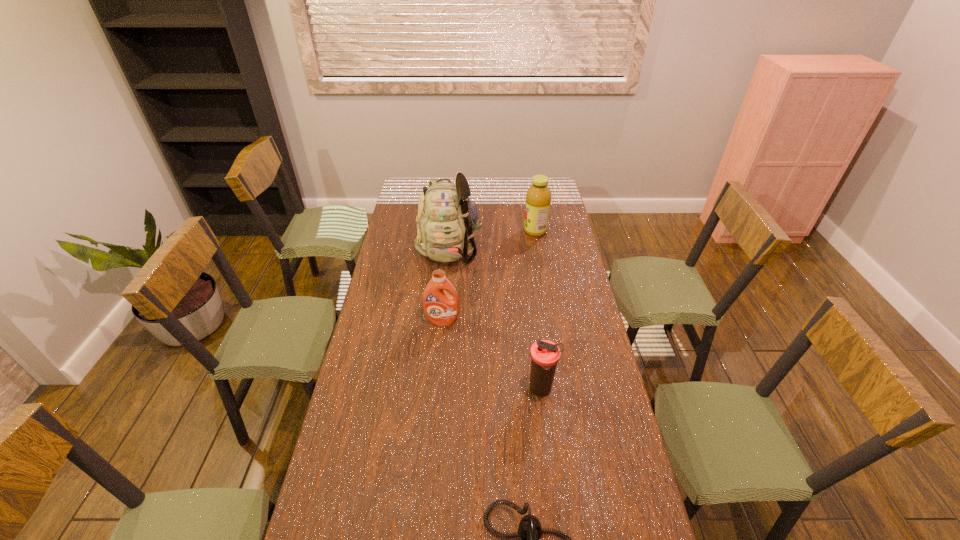
In order to click on free spot that satisfies the following two spatial constraints: 1. on the front label of the fruit juice; 2. on the front-facing side of the third nearest object in this screenshot , I will do `click(550, 321)`.

Where is `free location that satisfies the following two spatial constraints: 1. on the front-facing side of the backpack; 2. on the right side of the second nearest object`? This screenshot has height=540, width=960. free location that satisfies the following two spatial constraints: 1. on the front-facing side of the backpack; 2. on the right side of the second nearest object is located at coordinates pyautogui.click(x=438, y=389).

Where is `vacant space that satisfies the following two spatial constraints: 1. on the front label of the fruit juice; 2. on the front side of the second nearest object`? Image resolution: width=960 pixels, height=540 pixels. vacant space that satisfies the following two spatial constraints: 1. on the front label of the fruit juice; 2. on the front side of the second nearest object is located at coordinates (562, 389).